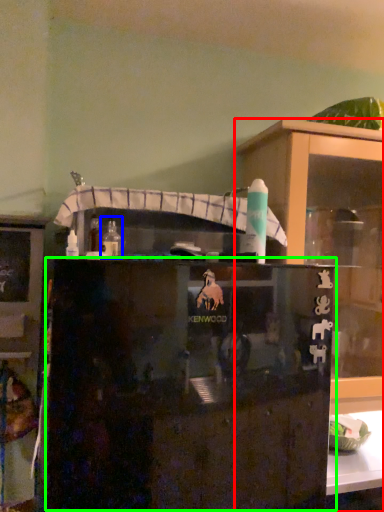
Question: Estimate the real-world distances between objects in this image. Which object is farther from cupboard (highlighted by a red box), bottle (highlighted by a blue box) or cabinetry (highlighted by a green box)?

Choices:
 (A) bottle
 (B) cabinetry

Answer: (A)